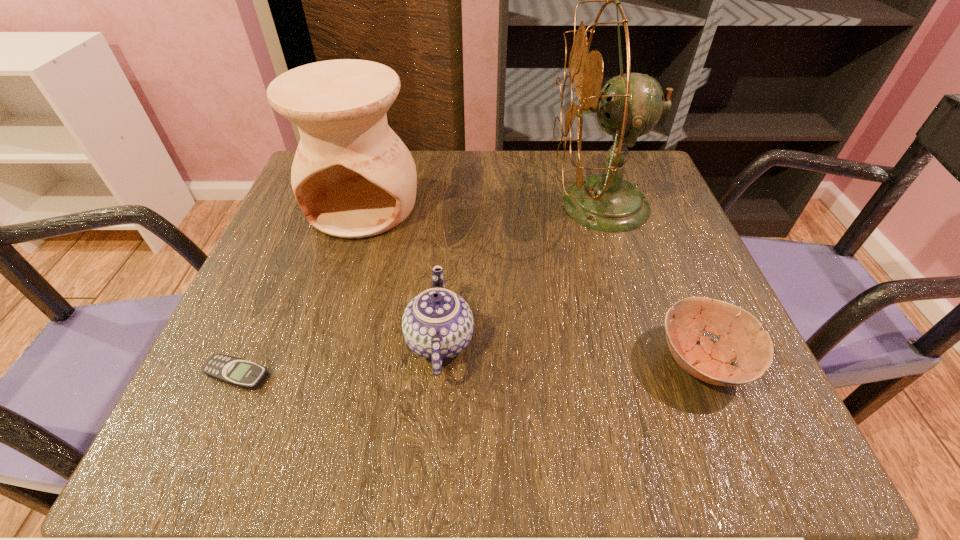
The height and width of the screenshot is (540, 960). In order to click on vacant space located 0.270m at the spout of the third object from left to right in this screenshot , I will do [x=637, y=341].

Locate an element on the screen. This screenshot has height=540, width=960. free region located 0.100m on the back of the bowl is located at coordinates (669, 280).

You are a GUI agent. You are given a task and a screenshot of the screen. Output one action in this format:
    pyautogui.click(x=<x>, y=<y>)
    Task: Click on the free space located 0.060m on the back of the beeper
    
    Given the screenshot: What is the action you would take?
    pyautogui.click(x=257, y=328)

Where is `fan at the far edge`? fan at the far edge is located at coordinates tap(630, 105).

At what (x,y) coordinates should I click in order to perform the action: click on pottery that is at the far edge. Please return your answer as a coordinate pair (x, y). Image resolution: width=960 pixels, height=540 pixels. Looking at the image, I should click on (353, 177).

Find the location of a particular element. object positioned at the near edge is located at coordinates (740, 337).

The width and height of the screenshot is (960, 540). Find the location of `pottery at the left edge`. pottery at the left edge is located at coordinates (353, 177).

I want to click on beeper present at the left edge, so click(x=238, y=372).

The width and height of the screenshot is (960, 540). What are the coordinates of `fan positioned at the right edge` in the screenshot? It's located at (630, 105).

Where is `bowl present at the right edge`? The width and height of the screenshot is (960, 540). bowl present at the right edge is located at coordinates (740, 337).